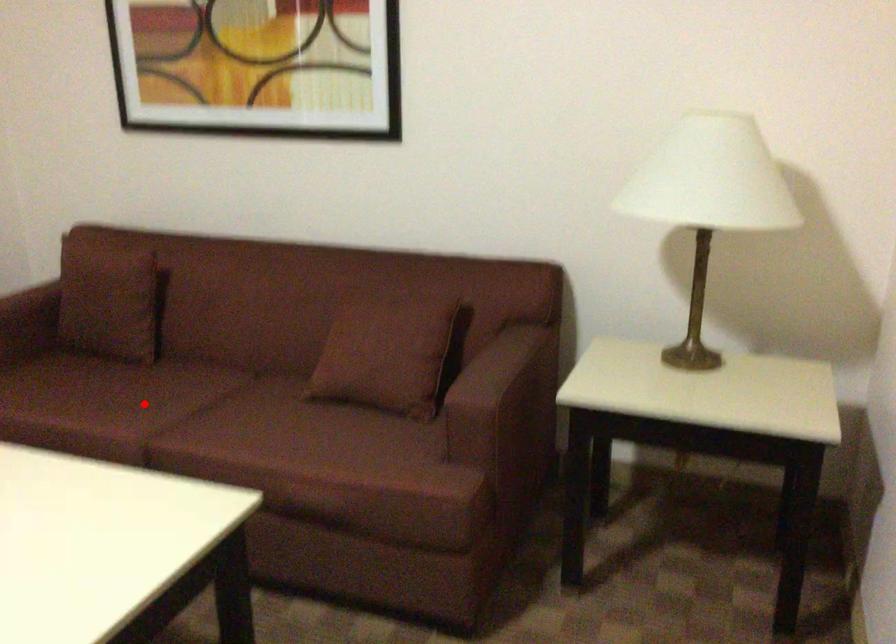
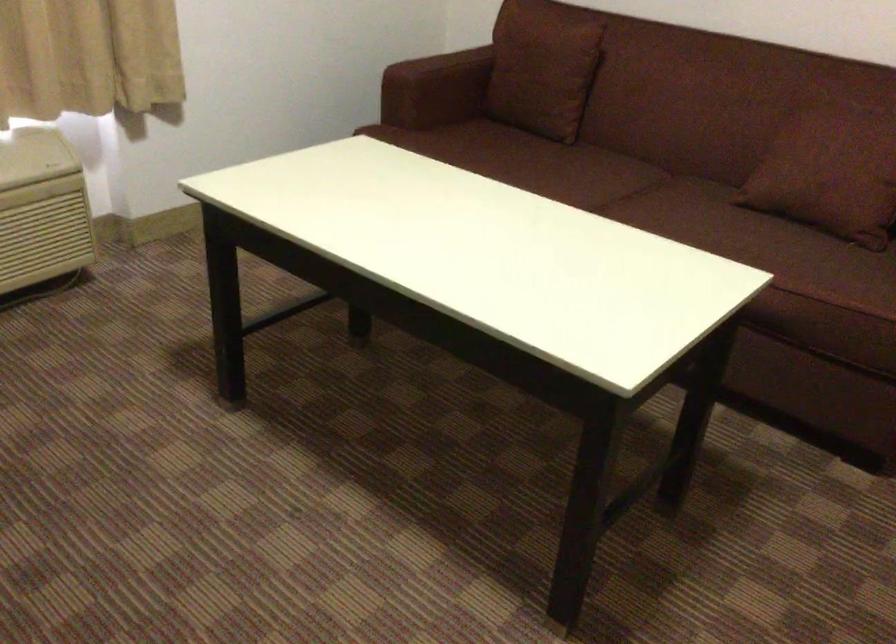
Find the pixel in the second image that matches the highlighted location in the first image.

(574, 176)